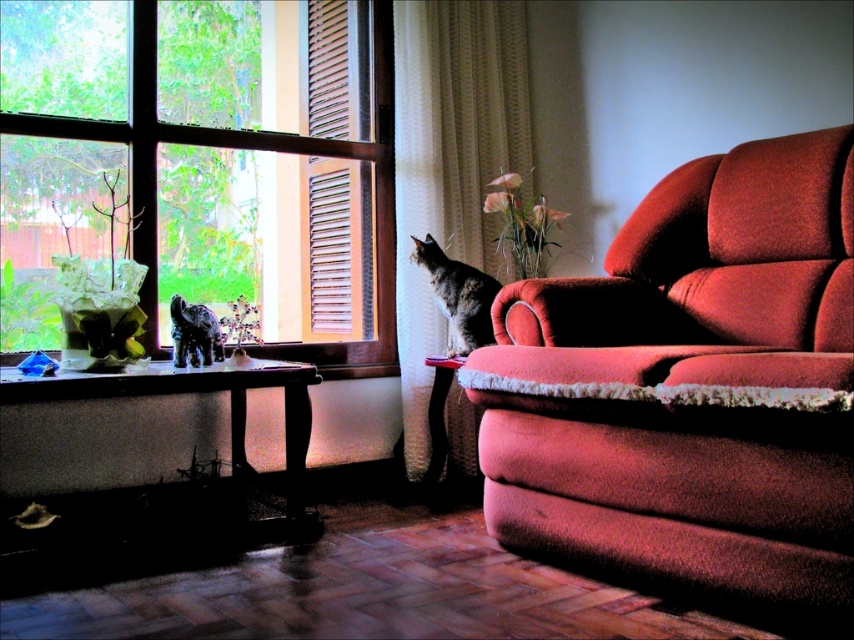
Based on the photo, you are a photographer standing at the camera position. You want to take a photo of the velvet red couch at right. Can you move closer to the couch to get a better closeup shot without moving the couch itself? Explain why or why not.

The velvet red couch at right and camera are 4.50 feet apart. Since you can move closer within the 4.50 feet distance between you and the couch, you can get a better closeup shot by moving forward towards the velvet red couch at right.